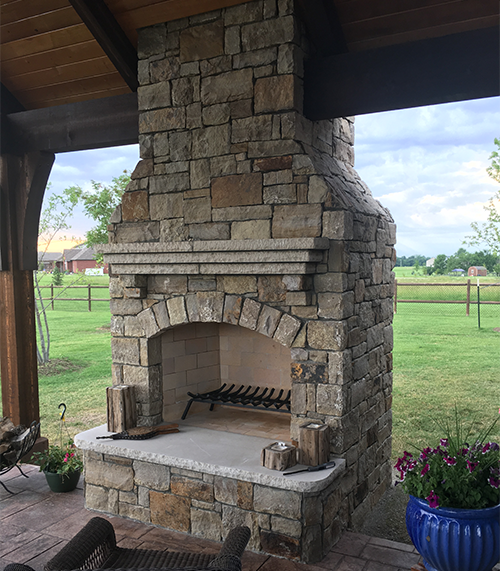
This screenshot has width=500, height=571. In order to click on wooden column in this screenshot , I will do `click(22, 281)`.